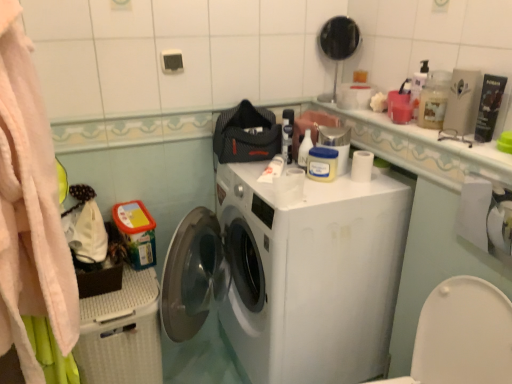
Where is `vacant area that is in front of metallic silver container at upper right`? This screenshot has width=512, height=384. vacant area that is in front of metallic silver container at upper right is located at coordinates (342, 189).